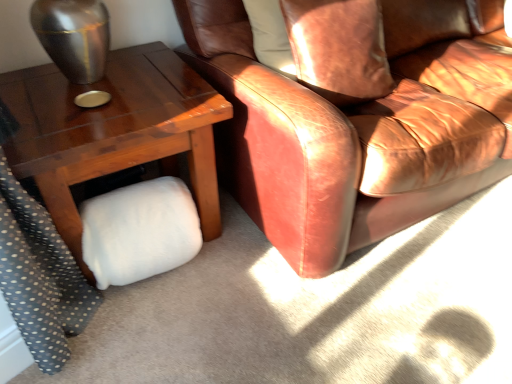
Question: From the image's perspective, is leather pillow at upper right above or below leather couch at center?

Choices:
 (A) above
 (B) below

Answer: (B)

Question: Considering their positions, is leather pillow at upper right located in front of or behind leather couch at center?

Choices:
 (A) front
 (B) behind

Answer: (B)

Question: Which object is positioned closest to the leather couch at center?

Choices:
 (A) wooden table at lower left
 (B) leather pillow at upper right
 (C) white fluffy pillow at lower left

Answer: (B)

Question: Which of these objects is positioned closest to the wooden table at lower left?

Choices:
 (A) leather couch at center
 (B) leather pillow at upper right
 (C) white fluffy pillow at lower left

Answer: (C)